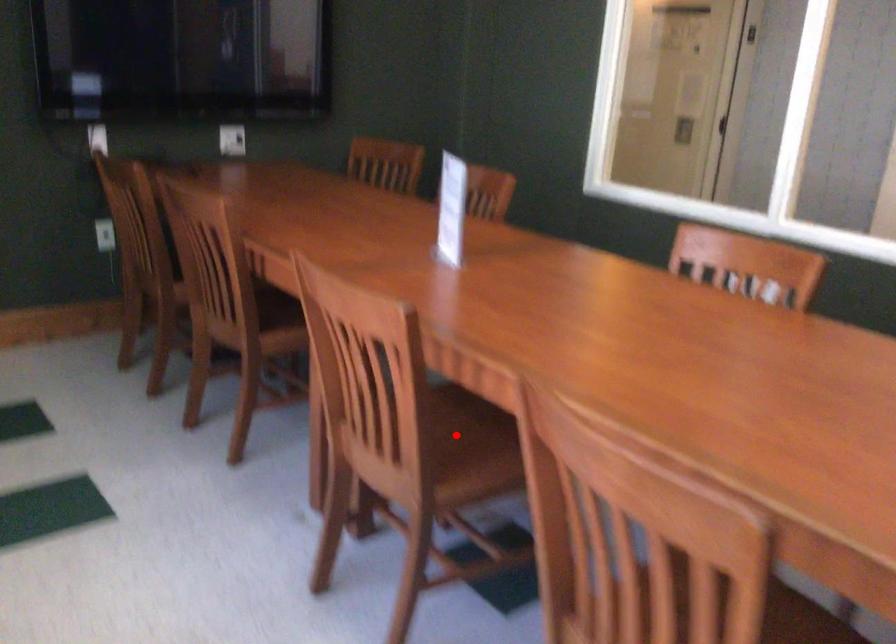
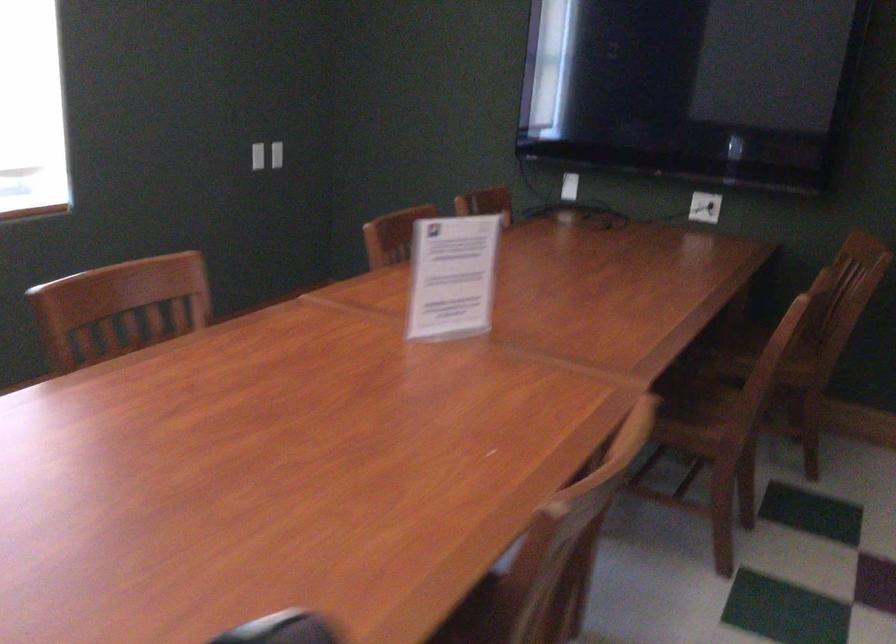
Question: I am providing you with two images of the same scene from different viewpoints. A red point is marked on the first image. Is the red point's position out of view in image 2?

Choices:
 (A) Yes
 (B) No

Answer: (A)